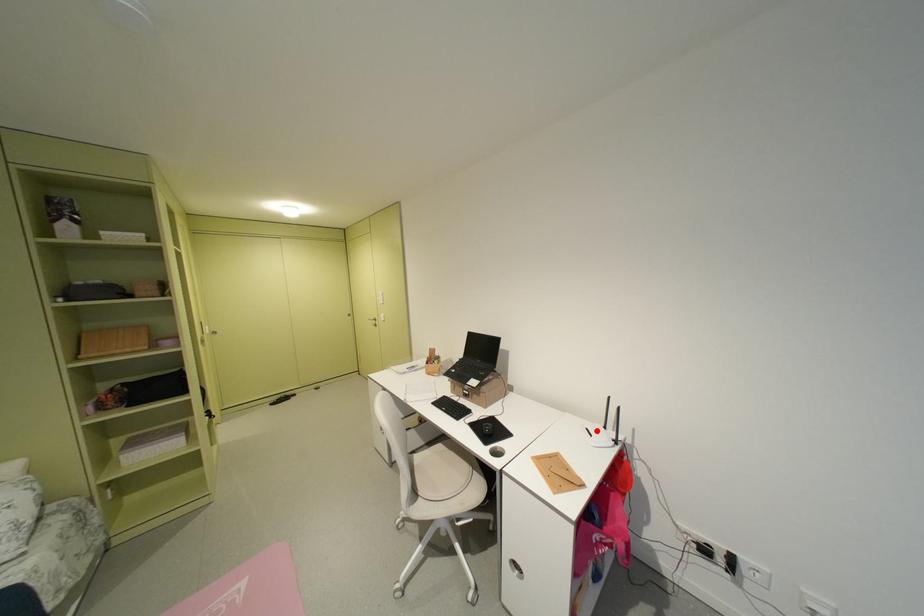
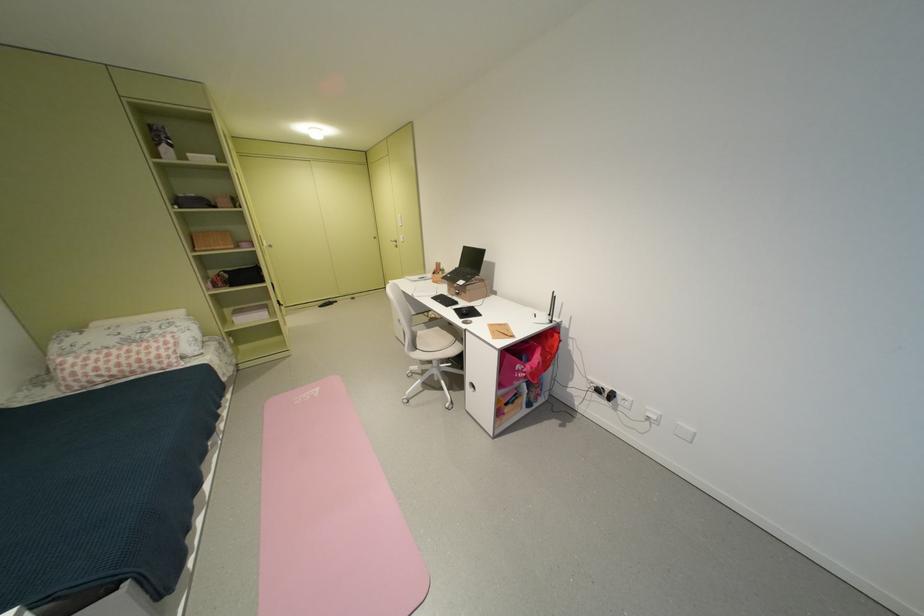
Where in the second image is the point corresponding to the highlighted location from the first image?

(544, 315)